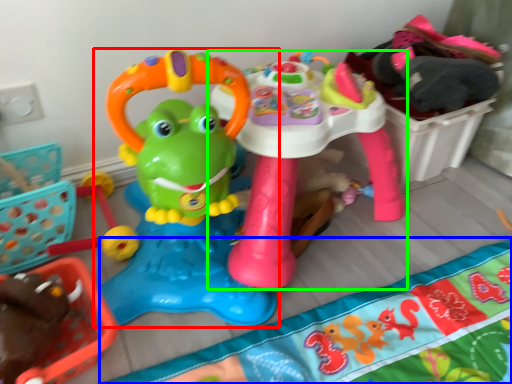
Question: Estimate the real-world distances between objects in this image. Which object is farther from toy (highlighted by a red box), blanket (highlighted by a blue box) or toy (highlighted by a green box)?

Choices:
 (A) blanket
 (B) toy

Answer: (A)